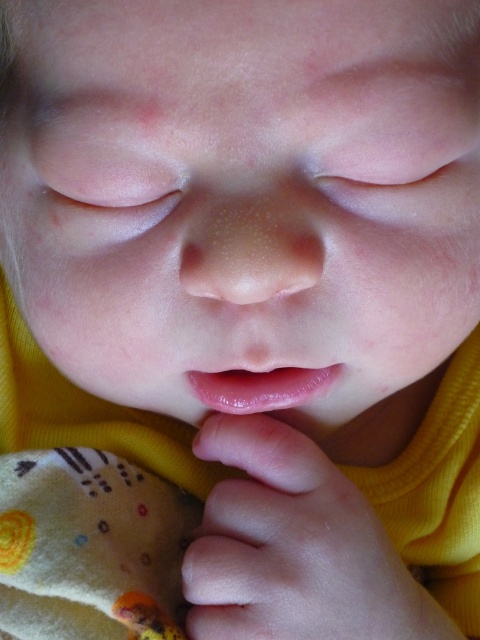
Who is more forward, (227,605) or (330,378)?

Point (227,605)

I want to click on pink smooth skin at lower center, so click(x=291, y=547).

Where is `pink smooth skin at lower center`? The height and width of the screenshot is (640, 480). pink smooth skin at lower center is located at coordinates (291, 547).